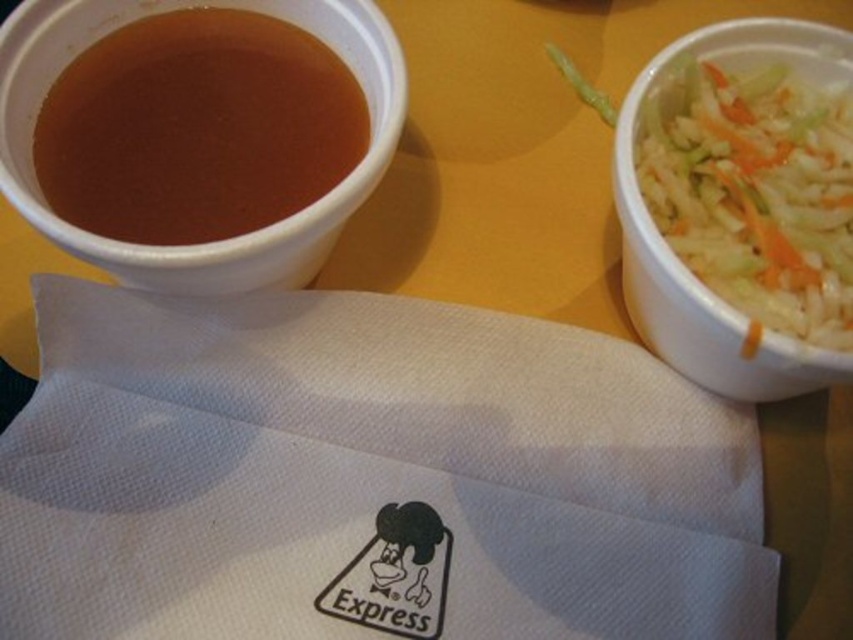
Between brown matte cup at upper left and white shredded food at right, which one appears on the right side from the viewer's perspective?

white shredded food at right

Is point (228, 184) less distant than point (724, 113)?

Yes, point (228, 184) is in front of point (724, 113).

Find the location of a particular element. The width and height of the screenshot is (853, 640). brown matte cup at upper left is located at coordinates (x=196, y=129).